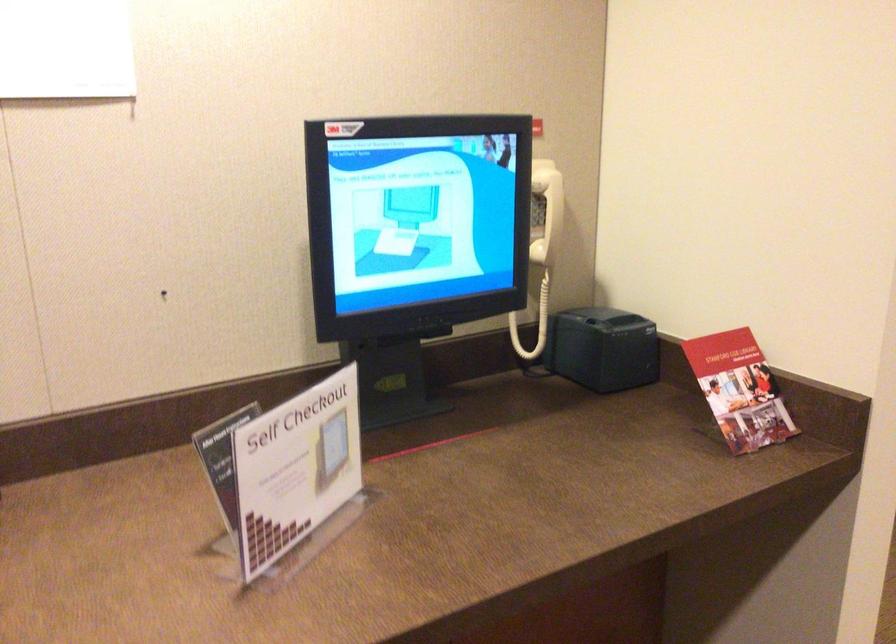
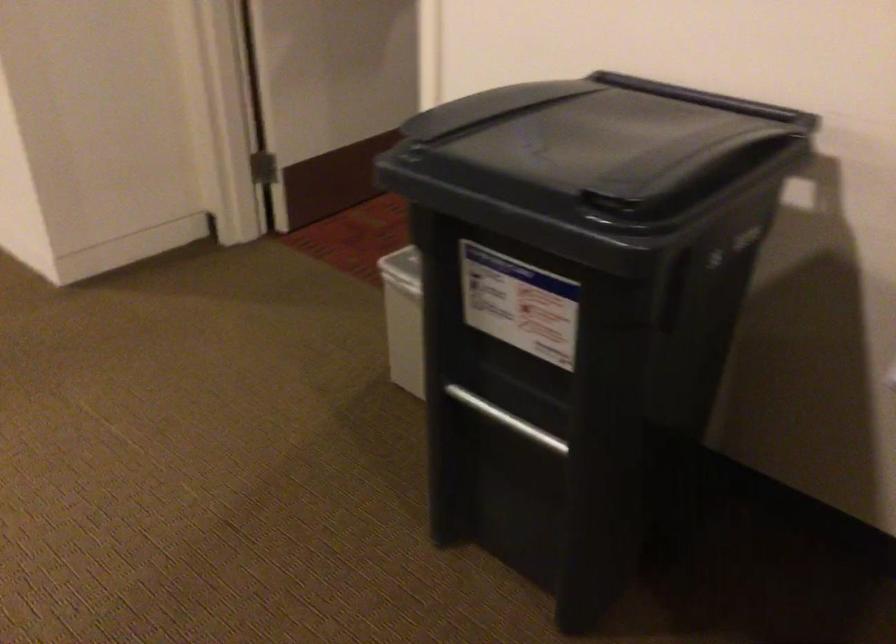
The images are taken continuously from a first-person perspective. In which direction is your viewpoint rotating?

The rotation direction of the camera is right-down.